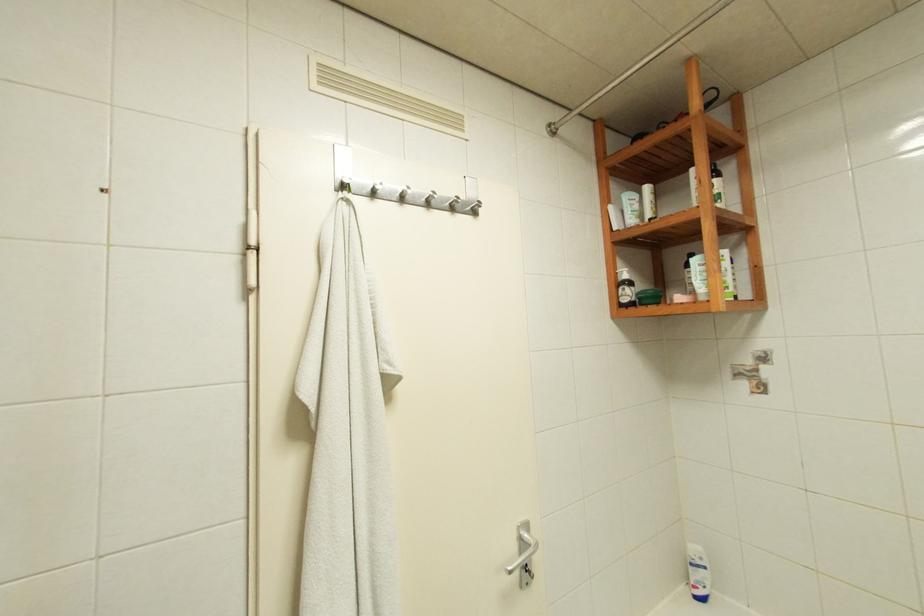
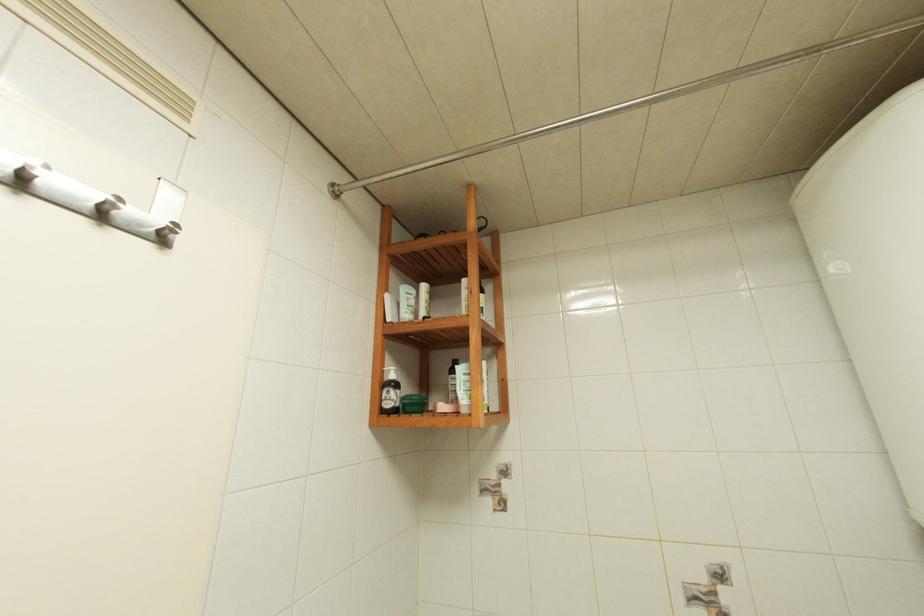
How did the camera likely rotate?

The camera's rotation is toward right-up.